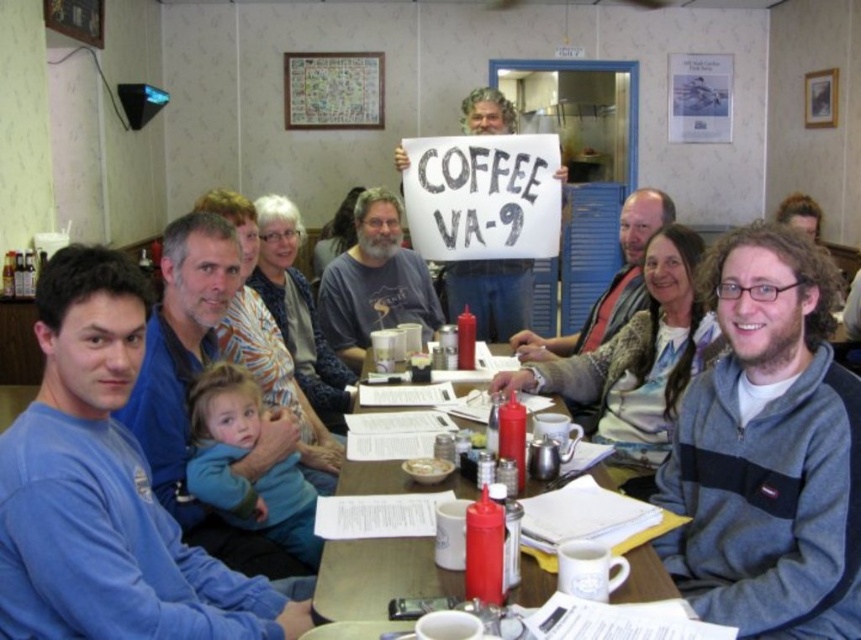
Is blue cotton shirt at left wider than white matte bowl at center?

Yes, blue cotton shirt at left is wider than white matte bowl at center.

Does blue cotton shirt at left have a lesser height compared to white matte bowl at center?

In fact, blue cotton shirt at left may be taller than white matte bowl at center.

What do you see at coordinates (104, 488) in the screenshot?
I see `blue cotton shirt at left` at bounding box center [104, 488].

Identify the location of blue cotton shirt at left. The height and width of the screenshot is (640, 861). [104, 488].

Is blue cotton shirt at left thinner than gray sweater at center?

Yes.

Does point (181, 620) lie behind point (626, 220)?

No, it is not.

Locate an element on the screen. This screenshot has height=640, width=861. blue cotton shirt at left is located at coordinates (104, 488).

Between wooden table at center and white matte bowl at center, which one is positioned lower?

wooden table at center

Is wooden table at center thinner than white matte bowl at center?

No.

Which is behind, point (372, 573) or point (422, 468)?

The point (422, 468) is behind.

Identify the location of wooden table at center. The width and height of the screenshot is (861, 640). (378, 577).